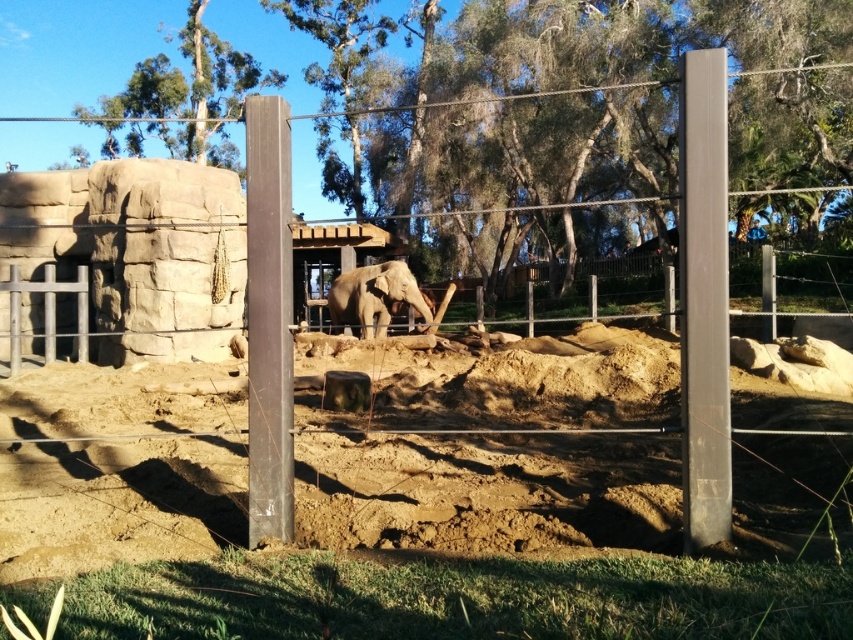
Is the position of smooth gray pole at right more distant than that of grayish-brown textured elephant at center?

No, it is not.

Is point (722, 497) positioned before point (376, 269)?

Yes.

Where is `smooth gray pole at right`? The height and width of the screenshot is (640, 853). smooth gray pole at right is located at coordinates (703, 300).

Is point (592, 13) closer to camera compared to point (700, 170)?

No, it is behind (700, 170).

At what (x,y) coordinates should I click in order to perform the action: click on green leafy tree at center. Please return your answer as a coordinate pair (x, y). Image resolution: width=853 pixels, height=640 pixels. Looking at the image, I should click on (573, 122).

Describe the element at coordinates (573, 122) in the screenshot. I see `green leafy tree at center` at that location.

The image size is (853, 640). Identify the location of green leafy tree at center. (573, 122).

Between green leafy tree at center and brown wooden fence at center, which one has less height?

Standing shorter between the two is brown wooden fence at center.

Does green leafy tree at center have a greater height compared to brown wooden fence at center?

Indeed, green leafy tree at center has a greater height compared to brown wooden fence at center.

Is point (496, 170) behind point (817, 291)?

Yes.

This screenshot has height=640, width=853. In order to click on green leafy tree at center in this screenshot , I will do (573, 122).